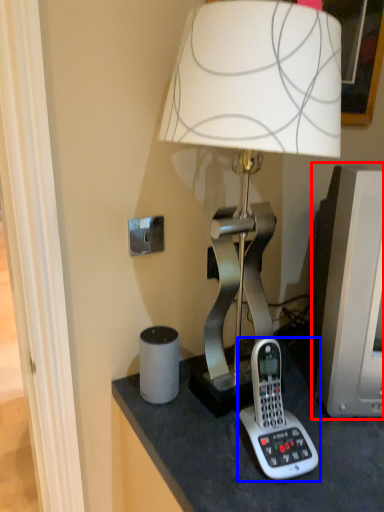
Question: Which point is further to the camera, computer monitor (highlighted by a red box) or corded phone (highlighted by a blue box)?

Choices:
 (A) computer monitor
 (B) corded phone

Answer: (A)